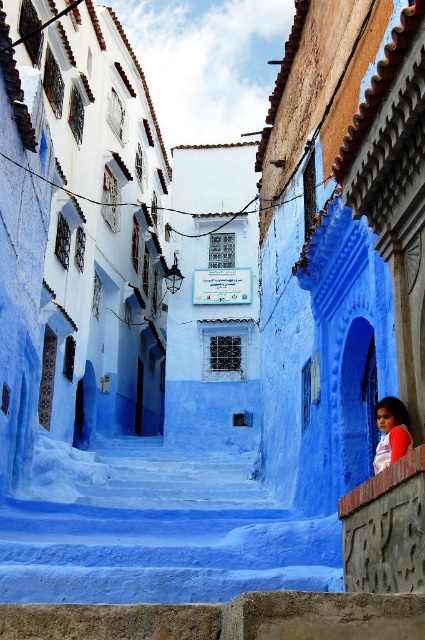
Does point (197, 502) come closer to viewer compared to point (399, 426)?

No, (197, 502) is further to viewer.

Measure the distance between smooth plaster stairs at center and camera.

40.76 meters

Which is in front, point (180, 449) or point (404, 420)?

Point (404, 420)

Locate an element on the screen. This screenshot has width=425, height=640. smooth plaster stairs at center is located at coordinates (155, 529).